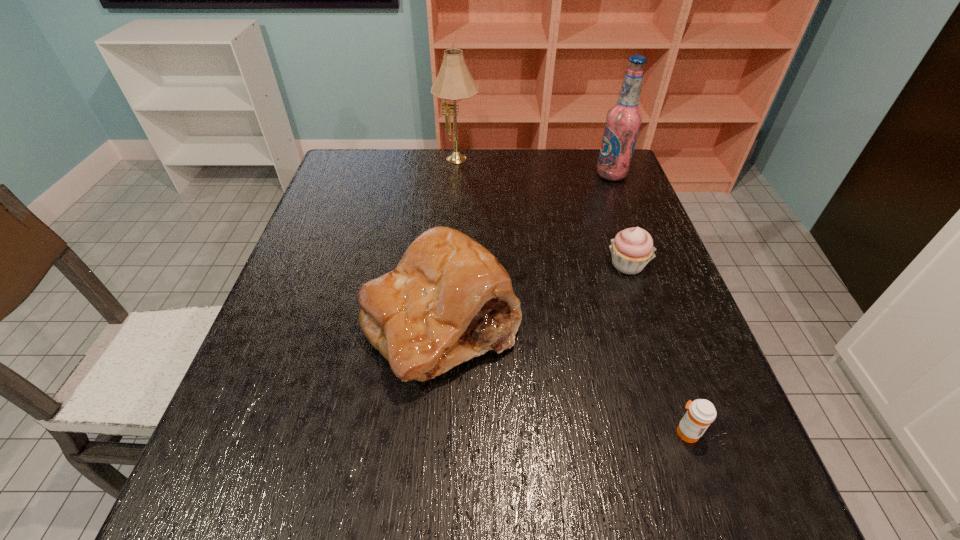
This screenshot has height=540, width=960. I want to click on free space between the fourth tallest object and the alcohol, so point(619,220).

Where is `blank region between the alcohol and the third shortest object`? The width and height of the screenshot is (960, 540). blank region between the alcohol and the third shortest object is located at coordinates (526, 249).

The image size is (960, 540). I want to click on object that is the fourth closest to the fourth tallest object, so click(x=454, y=82).

Identify which object is the second closest to the third shortest object. Please provide its 2D coordinates. Your answer should be formatted as a tuple, i.e. [(x, y)], where the tuple contains the x and y coordinates of a point satisfying the conditions above.

[(701, 413)]

Find the location of a particular element. free location that satisfies the following two spatial constraints: 1. on the filling side of the third shortest object; 2. on the right side of the nearest object is located at coordinates (432, 432).

Where is `free space that satisfies the following two spatial constraints: 1. on the filling side of the nearest object; 2. on the left side of the bread`? free space that satisfies the following two spatial constraints: 1. on the filling side of the nearest object; 2. on the left side of the bread is located at coordinates (432, 432).

Where is `vacant space that satisfies the following two spatial constraints: 1. on the filling side of the shortest object; 2. on the left side of the bread`? The height and width of the screenshot is (540, 960). vacant space that satisfies the following two spatial constraints: 1. on the filling side of the shortest object; 2. on the left side of the bread is located at coordinates pos(432,432).

The image size is (960, 540). I want to click on vacant space that satisfies the following two spatial constraints: 1. on the filling side of the bread; 2. on the right side of the shortest object, so click(x=432, y=432).

Locate an element on the screen. This screenshot has width=960, height=540. free space that satisfies the following two spatial constraints: 1. on the front side of the cupcake; 2. on the left side of the lampshade is located at coordinates (450, 265).